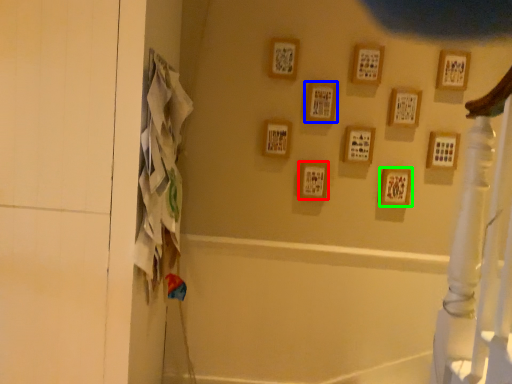
Question: Considering the real-world distances, which object is closest to picture frame (highlighted by a red box)? picture frame (highlighted by a blue box) or picture frame (highlighted by a green box).

Choices:
 (A) picture frame
 (B) picture frame

Answer: (A)